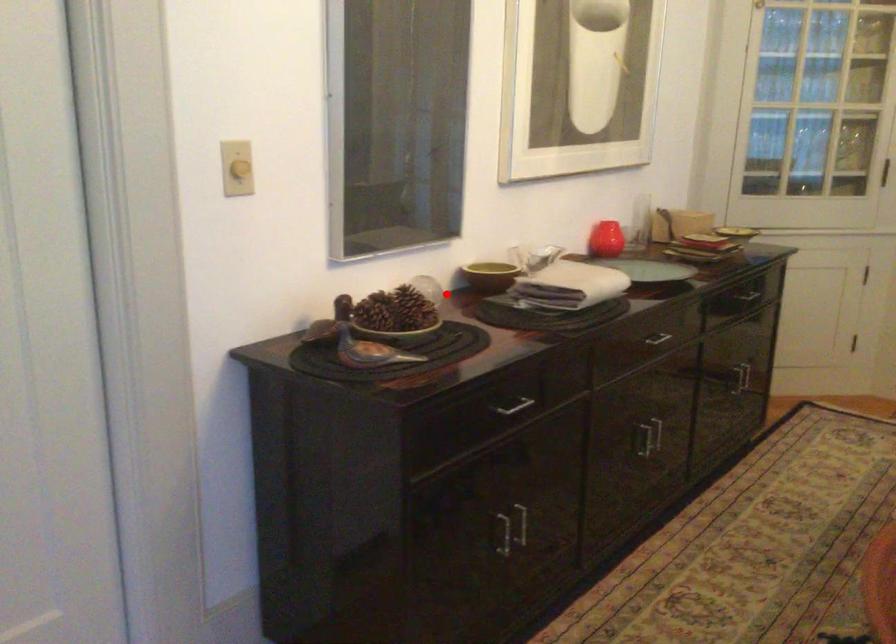
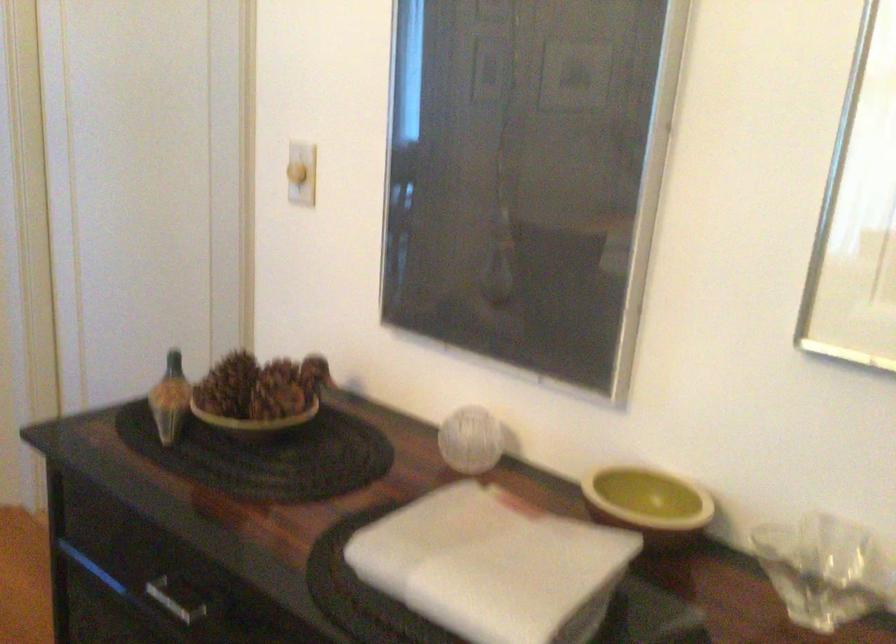
The point at the highlighted location is marked in the first image. Where is the corresponding point in the second image?

(470, 440)